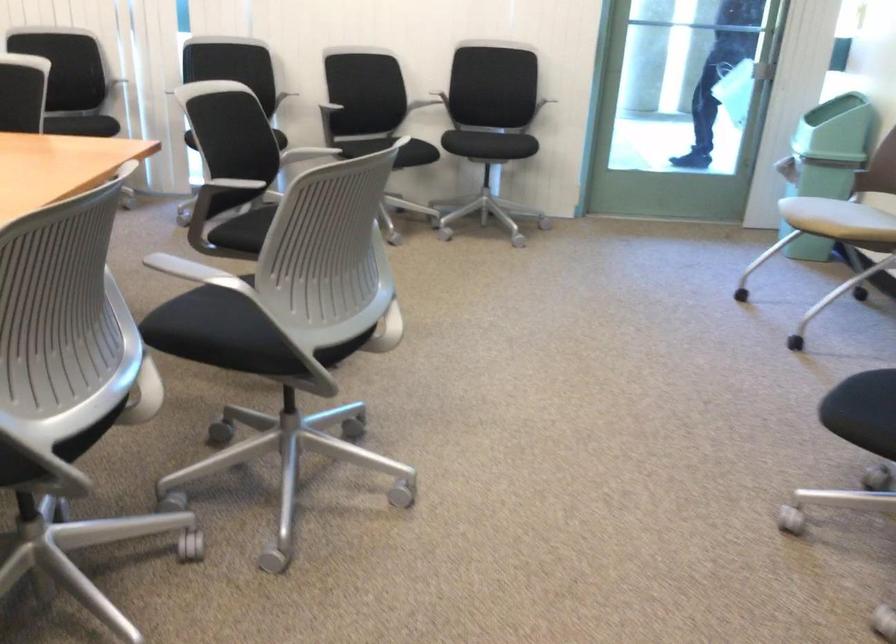
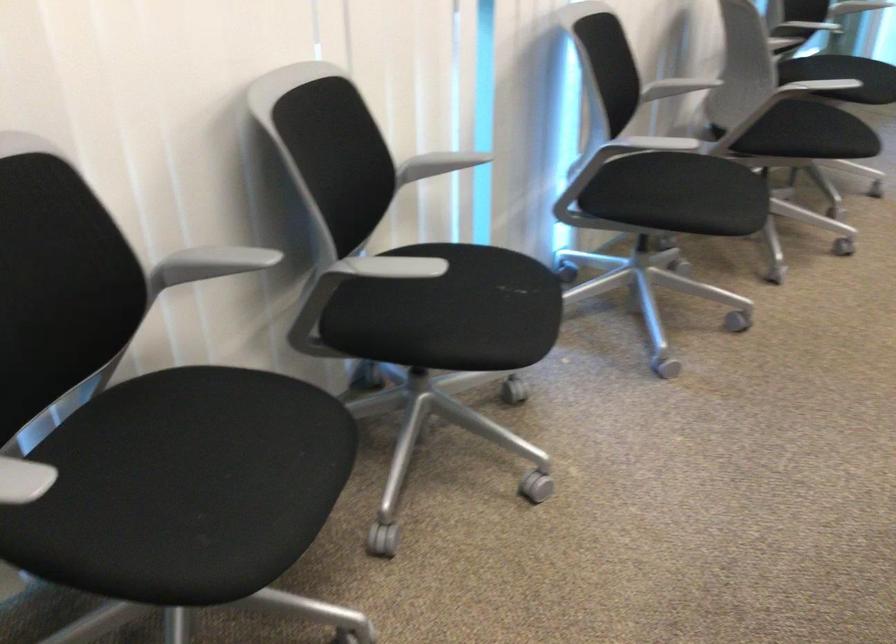
Where in the second image is the point corresponding to [88,114] from the first image?

(515, 287)